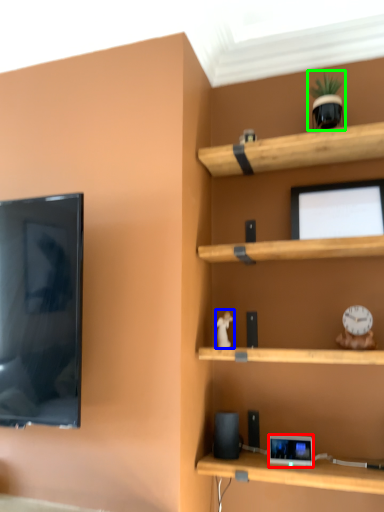
Question: Which object is the farthest from gadget (highlighted by a red box)? Choose among these: toy (highlighted by a blue box) or toy (highlighted by a green box).

Choices:
 (A) toy
 (B) toy

Answer: (B)